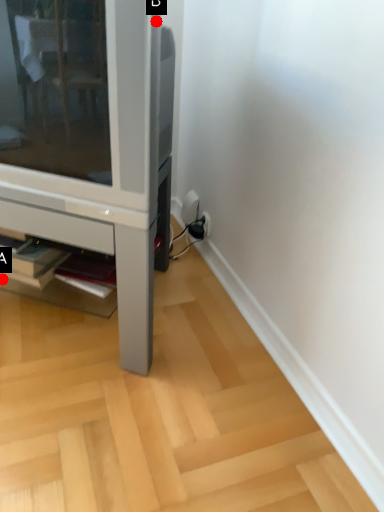
Question: Two points are circled on the image, labeled by A and B beside each circle. Which point is closer to the camera taking this photo?

Choices:
 (A) A is closer
 (B) B is closer

Answer: (B)